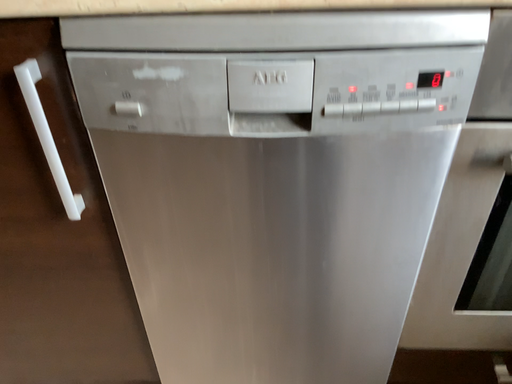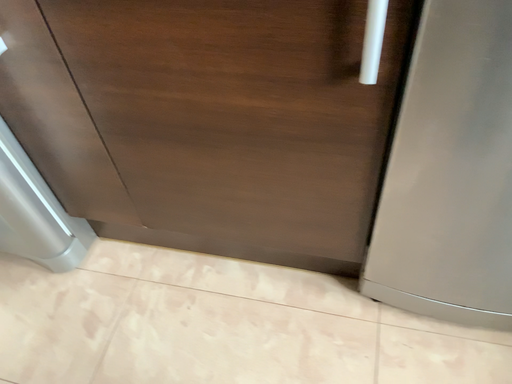
Question: How did the camera likely rotate when shooting the video?

Choices:
 (A) rotated upward
 (B) rotated downward

Answer: (B)